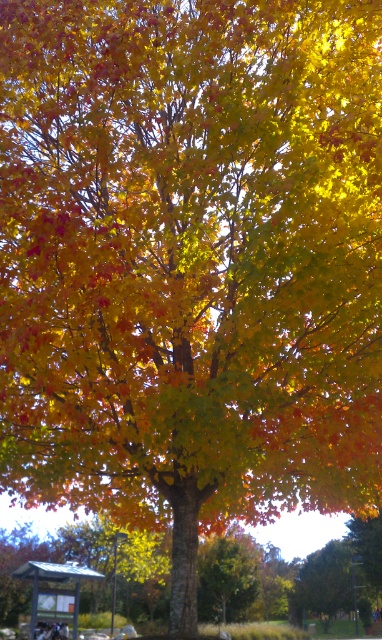
You are standing at the bus stop on the left side of the frame and want to walk to the point labeled point (247, 561). However, there is an obstacle at point (37, 580). Will you be able to reach your destination without going around the obstacle?

Since point (247, 561) is behind point (37, 580), you will have to go around the obstacle at point (37, 580) to reach your destination.

You are standing in an autumn park and see the shiny green leaf at center and the metallic silver bus stop at lower left. Which object is closer to you?

The shiny green leaf at center is closer to you because it is further to the viewer than the metallic silver bus stop at lower left.